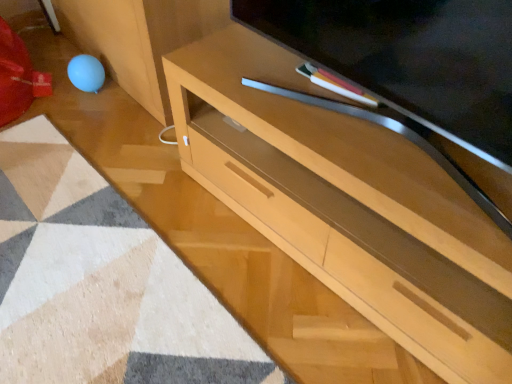
Question: Is matte wood television at center bigger or smaller than light wood desk at center?

Choices:
 (A) small
 (B) big

Answer: (A)

Question: Relative to light wood desk at center, is matte wood television at center in front or behind?

Choices:
 (A) front
 (B) behind

Answer: (A)

Question: Estimate the real-world distances between objects in this image. Which object is farther from the matte wood television at center?

Choices:
 (A) light wood desk at center
 (B) beige textured mat at lower left

Answer: (B)

Question: Which object is positioned farthest from the matte wood television at center?

Choices:
 (A) beige textured mat at lower left
 (B) light wood desk at center

Answer: (A)